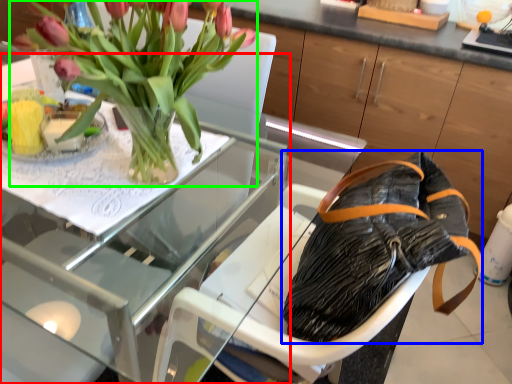
Question: Which is farther away from table (highlighted by a red box)? handbag (highlighted by a blue box) or houseplant (highlighted by a green box)?

Choices:
 (A) handbag
 (B) houseplant

Answer: (A)